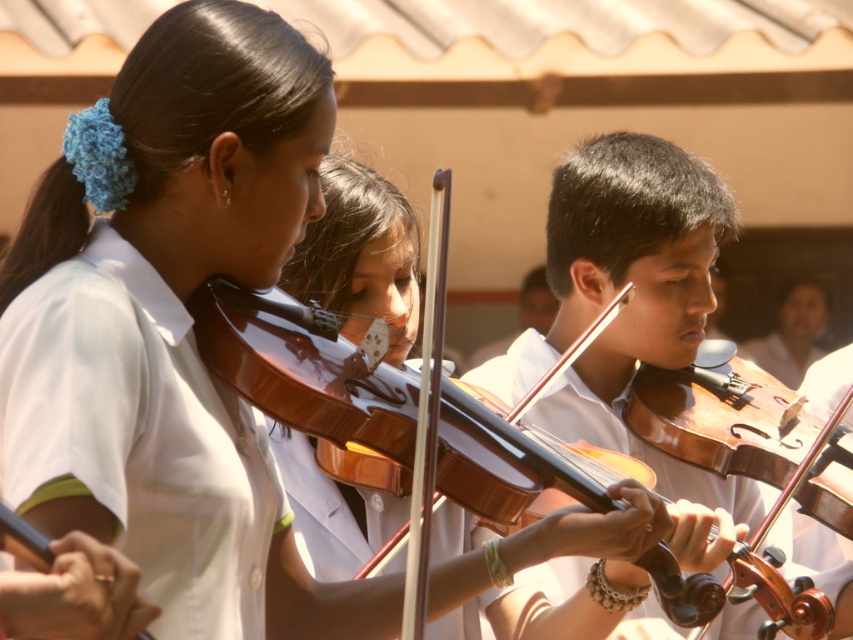
Question: Can you confirm if wooden violin at center is positioned below shiny brown violin at center?

Choices:
 (A) no
 (B) yes

Answer: (A)

Question: Does wooden violin at center have a lesser width compared to shiny brown violin at center?

Choices:
 (A) yes
 (B) no

Answer: (A)

Question: Which of the following is the closest to the observer?

Choices:
 (A) wooden violin at center
 (B) shiny brown violin at center

Answer: (B)

Question: Which object appears closest to the camera in this image?

Choices:
 (A) wooden violin at center
 (B) shiny brown violin at center

Answer: (B)

Question: Does wooden violin at center appear on the right side of shiny brown violin at center?

Choices:
 (A) yes
 (B) no

Answer: (A)